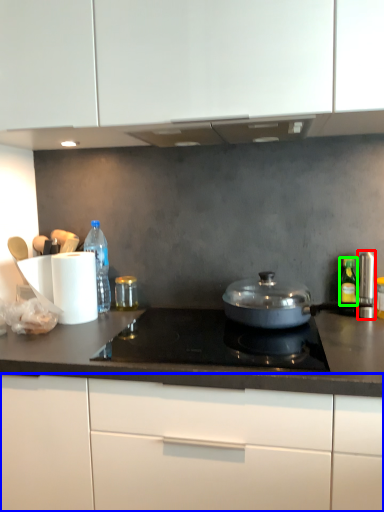
Question: Which object is positioned farthest from appliance (highlighted by a red box)? Select from cabinetry (highlighted by a blue box) and bottle (highlighted by a green box).

Choices:
 (A) cabinetry
 (B) bottle

Answer: (A)